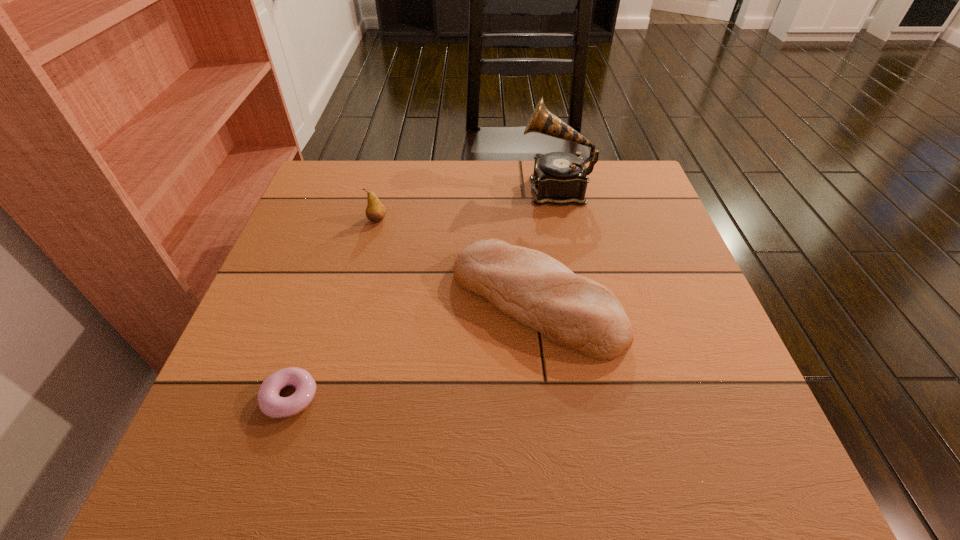
Image resolution: width=960 pixels, height=540 pixels. I want to click on vacant area at the near left corner of the desktop, so click(x=250, y=435).

Where is `free space at the far right corner of the desktop`? Image resolution: width=960 pixels, height=540 pixels. free space at the far right corner of the desktop is located at coordinates (651, 202).

The height and width of the screenshot is (540, 960). Identify the location of vacant space that's between the tallest object and the second nearest object. (545, 245).

Where is `unoccupied position between the third nearest object and the farthest object`? This screenshot has width=960, height=540. unoccupied position between the third nearest object and the farthest object is located at coordinates [x=467, y=205].

The height and width of the screenshot is (540, 960). I want to click on free space between the bread and the doughnut, so pyautogui.click(x=413, y=349).

Where is `free area in between the pear and the nearest object`? The height and width of the screenshot is (540, 960). free area in between the pear and the nearest object is located at coordinates (334, 308).

The width and height of the screenshot is (960, 540). I want to click on vacant area that lies between the shortest object and the pear, so click(334, 308).

Image resolution: width=960 pixels, height=540 pixels. Find the location of `free space between the pear and the phonograph record`. free space between the pear and the phonograph record is located at coordinates (467, 205).

Find the location of `free space between the bread and the phonograph record`. free space between the bread and the phonograph record is located at coordinates (545, 245).

I want to click on empty space that is in between the tallest object and the second nearest object, so click(545, 245).